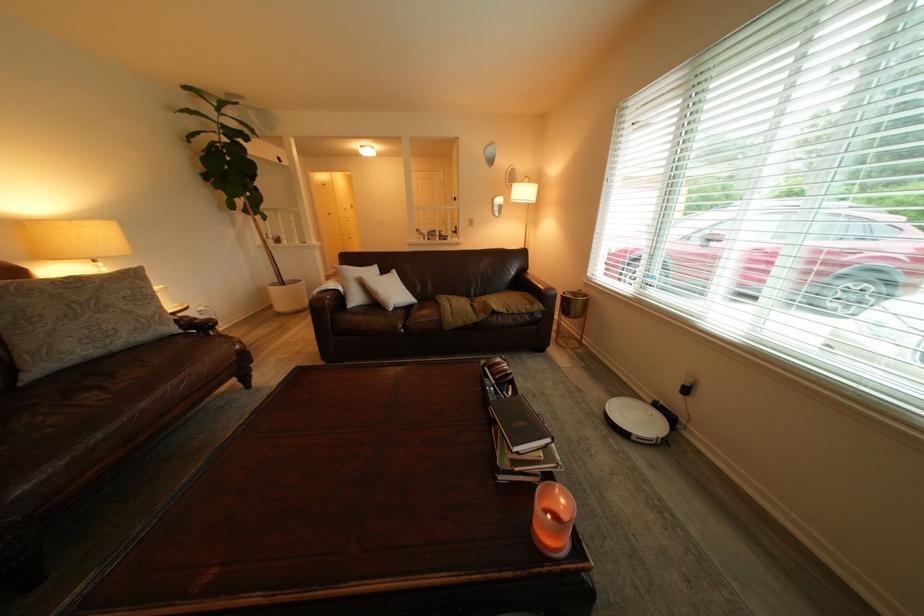
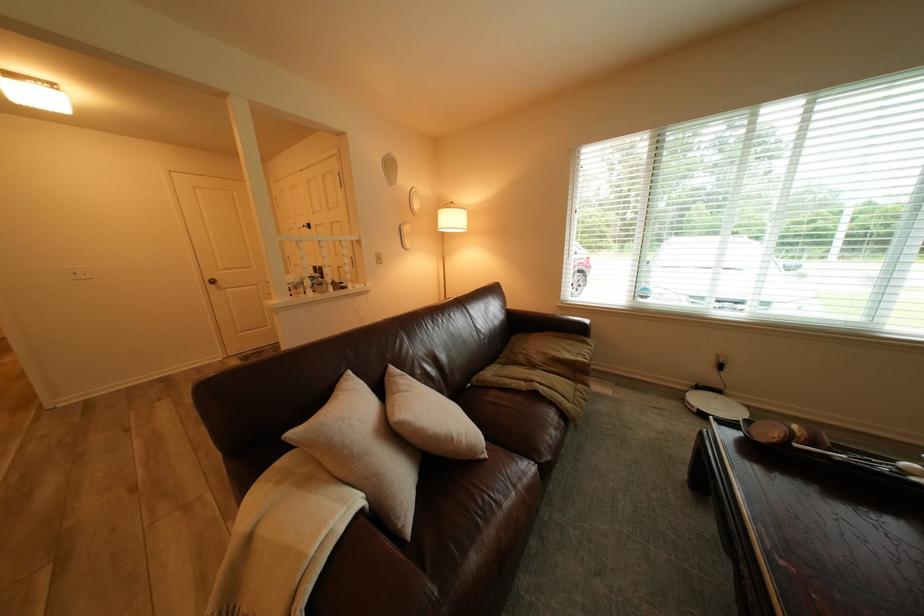
Locate, in the second image, the point that corresponds to pixel 351 282 in the first image.

(320, 483)